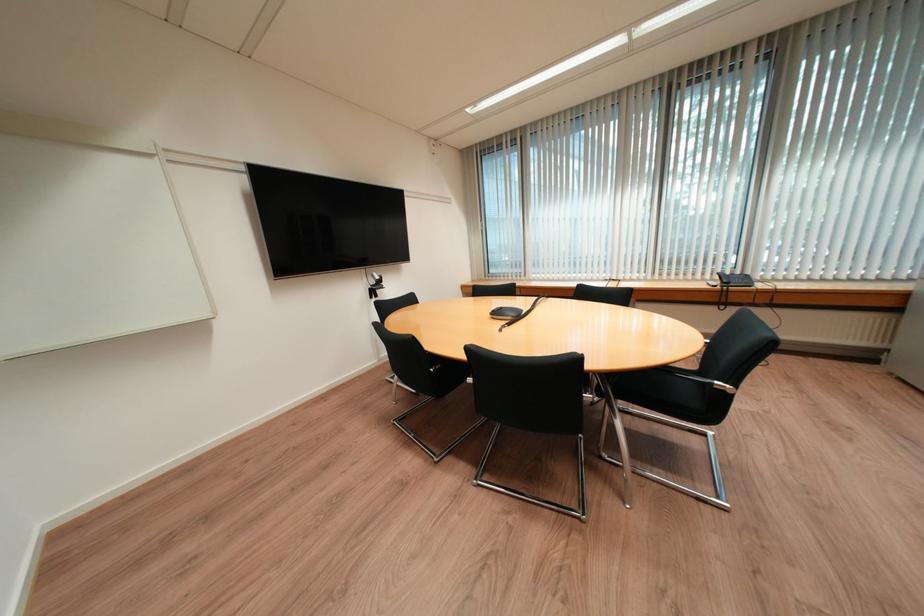
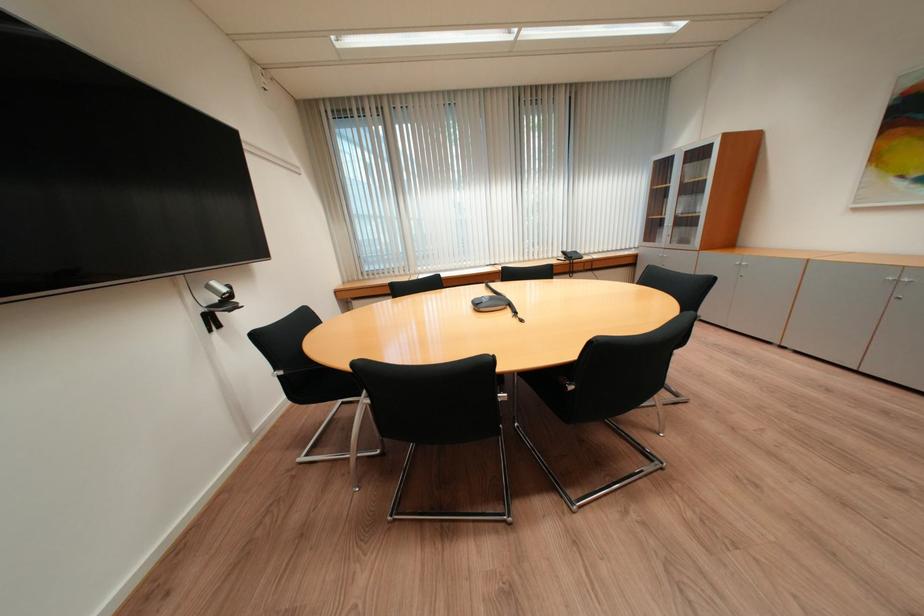
Find the pixel in the second image that matches [382,277] in the first image.

(217, 289)